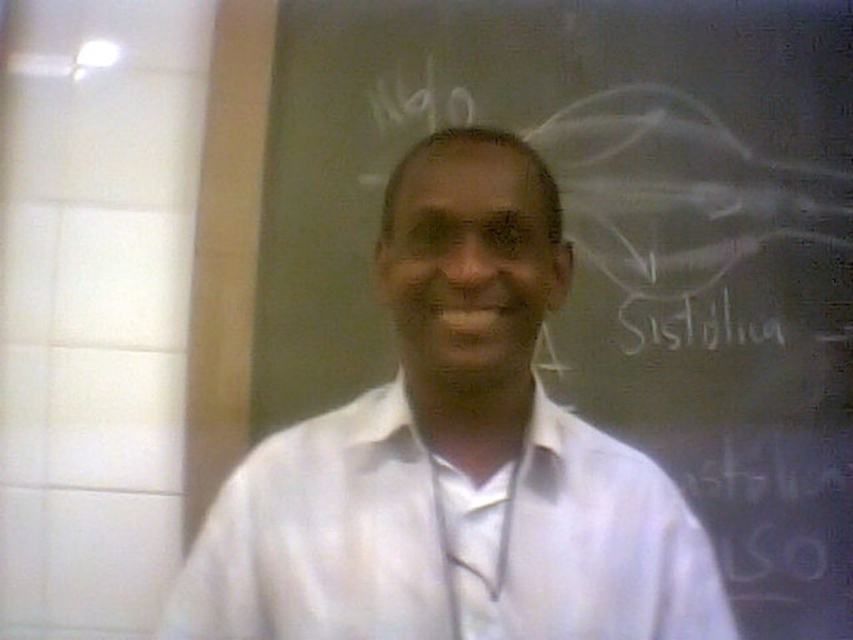
Question: Where is blackboard at center located in relation to white smooth dress shirt at center in the image?

Choices:
 (A) right
 (B) left

Answer: (A)

Question: Which object appears farthest from the camera in this image?

Choices:
 (A) white smooth dress shirt at center
 (B) blackboard at center

Answer: (B)

Question: Can you confirm if blackboard at center is positioned below white smooth dress shirt at center?

Choices:
 (A) yes
 (B) no

Answer: (B)

Question: Which point is farther to the camera?

Choices:
 (A) (523, 8)
 (B) (299, 616)

Answer: (A)

Question: Is blackboard at center positioned at the back of white smooth dress shirt at center?

Choices:
 (A) yes
 (B) no

Answer: (A)